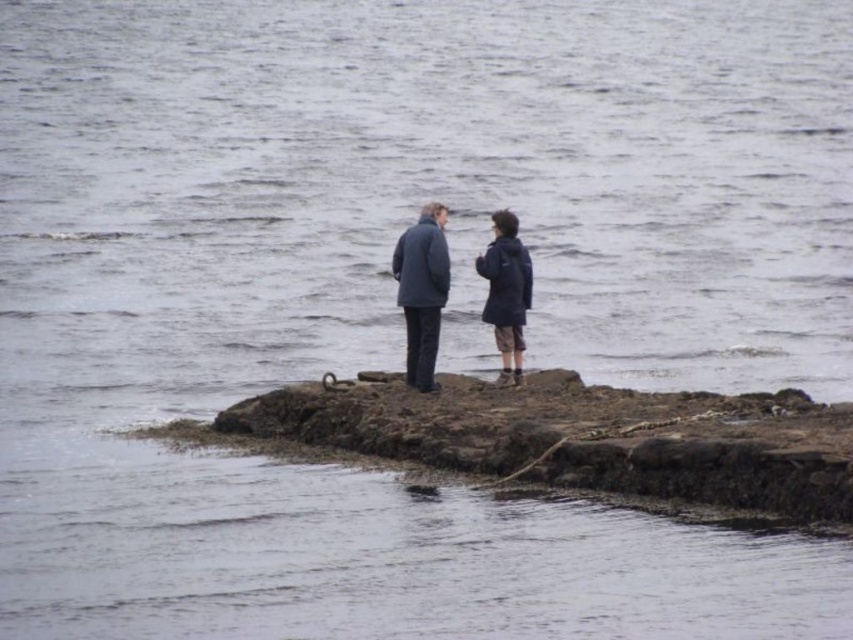
Question: Can you confirm if matte blue jacket at center is positioned above dark gray wool coat at center?

Choices:
 (A) no
 (B) yes

Answer: (A)

Question: Is matte blue jacket at center wider than dark blue jacket at center?

Choices:
 (A) no
 (B) yes

Answer: (A)

Question: Which is farther from the matte blue jacket at center?

Choices:
 (A) dark blue jacket at center
 (B) dark gray wool coat at center

Answer: (B)

Question: Which object is the closest to the dark gray wool coat at center?

Choices:
 (A) matte blue jacket at center
 (B) dark blue jacket at center

Answer: (B)

Question: Considering the relative positions of matte blue jacket at center and dark blue jacket at center in the image provided, where is matte blue jacket at center located with respect to dark blue jacket at center?

Choices:
 (A) below
 (B) above

Answer: (A)

Question: Which point appears closest to the camera in this image?

Choices:
 (A) (480, 260)
 (B) (506, 269)
 (C) (430, 321)

Answer: (C)